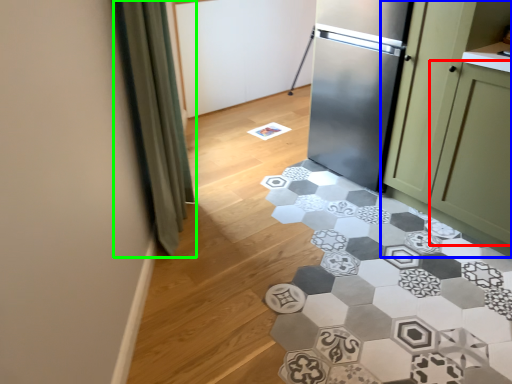
Question: Estimate the real-world distances between objects in this image. Which object is closer to glass door (highlighted by a red box), cabinetry (highlighted by a blue box) or curtain (highlighted by a green box)?

Choices:
 (A) cabinetry
 (B) curtain

Answer: (A)